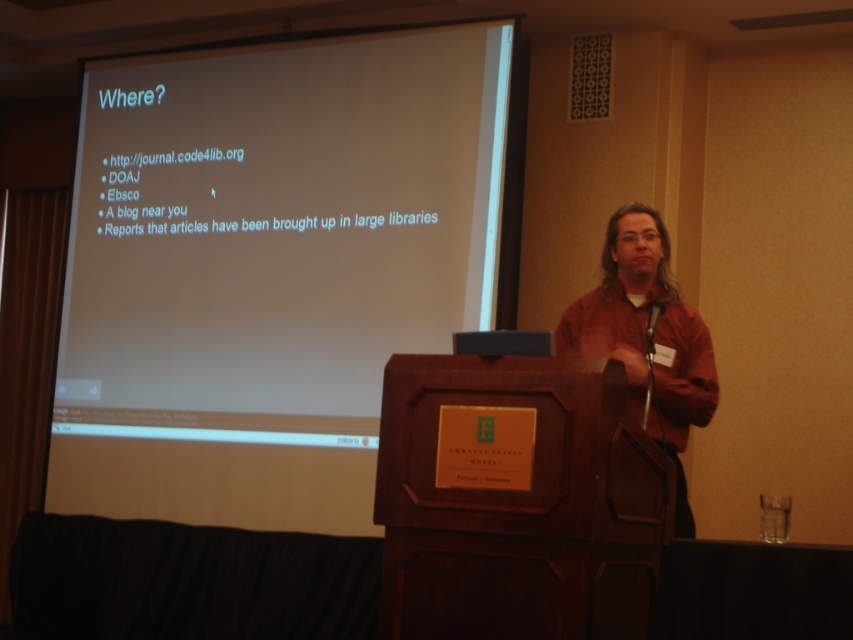
Question: Among these objects, which one is nearest to the camera?

Choices:
 (A) brown leather jacket at right
 (B) dark wood podium at center

Answer: (B)

Question: Which is farther from the white matte projection screen at upper left?

Choices:
 (A) dark wood podium at center
 (B) brown leather jacket at right

Answer: (A)

Question: Can you confirm if white matte projection screen at upper left is wider than dark wood podium at center?

Choices:
 (A) yes
 (B) no

Answer: (A)

Question: In this image, where is white matte projection screen at upper left located relative to brown leather jacket at right?

Choices:
 (A) below
 (B) above

Answer: (B)

Question: Which point appears farthest from the camera in this image?

Choices:
 (A) (409, 608)
 (B) (160, 161)

Answer: (B)

Question: Is white matte projection screen at upper left in front of brown leather jacket at right?

Choices:
 (A) yes
 (B) no

Answer: (B)